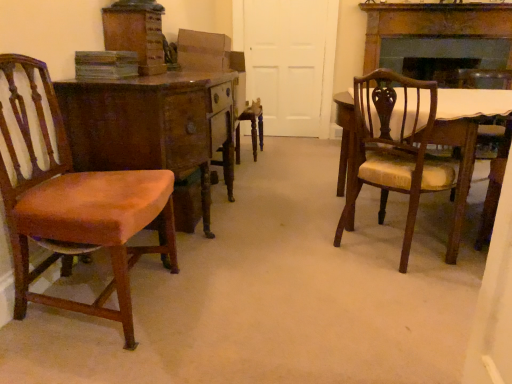
What do you see at coordinates (395, 146) in the screenshot?
I see `matte brown chair at right, positioned as the 2th chair in left-to-right order` at bounding box center [395, 146].

What is the approximate width of matte brown chair at right, positioned as the first chair in right-to-left order?

matte brown chair at right, positioned as the first chair in right-to-left order, is 14.33 inches wide.

Where is `wooden desk at left`? wooden desk at left is located at coordinates (143, 125).

At what (x,y) coordinates should I click in order to perform the action: click on matte brown chair at right, positioned as the first chair in right-to-left order. Please return your answer as a coordinate pair (x, y). Looking at the image, I should click on (395, 146).

From the image's perspective, which is below, wooden desk at left or matte brown chair at left, which appears as the 2th chair when viewed from the right?

matte brown chair at left, which appears as the 2th chair when viewed from the right.

Considering the relative sizes of wooden desk at left and matte brown chair at left, the first chair from the left, in the image provided, is wooden desk at left taller than matte brown chair at left, the first chair from the left,?

Incorrect, the height of wooden desk at left is not larger of that of matte brown chair at left, the first chair from the left.

Is matte brown chair at left, the first chair from the left, at the back of wooden desk at left?

That's not correct — wooden desk at left is not looking away from matte brown chair at left, the first chair from the left.

Can you see wooden desk at left touching matte brown chair at left, which appears as the 2th chair when viewed from the right?

wooden desk at left and matte brown chair at left, which appears as the 2th chair when viewed from the right, are not in contact.

Looking at this image, are white matte door at center and matte brown chair at left, which appears as the 2th chair when viewed from the right, located far from each other?

Yes, white matte door at center and matte brown chair at left, which appears as the 2th chair when viewed from the right, are quite far apart.

From a real-world perspective, starting from the white matte door at center, which chair is the 1st one below it? Please provide its 2D coordinates.

[(75, 205)]

Is white matte door at center bigger or smaller than matte brown chair at left, the first chair from the left?

Considering their sizes, white matte door at center takes up less space than matte brown chair at left, the first chair from the left.

How much distance is there between white matte door at center and matte brown chair at left, the first chair from the left?

white matte door at center is 3.13 meters away from matte brown chair at left, the first chair from the left.

Is matte brown chair at right, positioned as the first chair in right-to-left order, located within matte brown chair at left, the first chair from the left?

No, matte brown chair at left, the first chair from the left, does not contain matte brown chair at right, positioned as the first chair in right-to-left order.

You are a GUI agent. You are given a task and a screenshot of the screen. Output one action in this format:
    pyautogui.click(x=<x>, y=<y>)
    Task: Click on the chair located underneath the matte brown chair at left, the first chair from the left (from a real-world perspective)
    
    Given the screenshot: What is the action you would take?
    pyautogui.click(x=395, y=146)

Is matte brown chair at left, the first chair from the left, far away from matte brown chair at right, positioned as the 2th chair in left-to-right order?

Indeed, matte brown chair at left, the first chair from the left, is not near matte brown chair at right, positioned as the 2th chair in left-to-right order.

Is matte brown chair at left, which appears as the 2th chair when viewed from the right, closer to the viewer compared to matte brown chair at right, positioned as the first chair in right-to-left order?

Yes, matte brown chair at left, which appears as the 2th chair when viewed from the right, is closer to the viewer.

Considering the sizes of objects matte brown chair at left, which appears as the 2th chair when viewed from the right, and wooden desk at left in the image provided, who is thinner, matte brown chair at left, which appears as the 2th chair when viewed from the right, or wooden desk at left?

matte brown chair at left, which appears as the 2th chair when viewed from the right.

Are matte brown chair at left, the first chair from the left, and wooden desk at left far apart?

No, there isn't a large distance between matte brown chair at left, the first chair from the left, and wooden desk at left.

Is matte brown chair at left, the first chair from the left, oriented away from wooden desk at left?

That's not correct — matte brown chair at left, the first chair from the left, is not looking away from wooden desk at left.

How many degrees apart are the facing directions of matte brown chair at left, the first chair from the left, and wooden desk at left?

There is a 0.0944-degree angle between the facing directions of matte brown chair at left, the first chair from the left, and wooden desk at left.

From a real-world perspective, is matte brown chair at right, positioned as the first chair in right-to-left order, on top of wooden desk at left?

Yes, from a real-world perspective, matte brown chair at right, positioned as the first chair in right-to-left order, is on top of wooden desk at left.

Is matte brown chair at right, positioned as the 2th chair in left-to-right order, facing away from wooden desk at left?

That's not correct — matte brown chair at right, positioned as the 2th chair in left-to-right order, is not looking away from wooden desk at left.

From the picture: Is wooden desk at left a part of matte brown chair at right, positioned as the 2th chair in left-to-right order?

No, wooden desk at left is not surrounded by matte brown chair at right, positioned as the 2th chair in left-to-right order.

Is white matte door at center located within matte brown chair at left, the first chair from the left?

No, white matte door at center is not a part of matte brown chair at left, the first chair from the left.

Is matte brown chair at left, which appears as the 2th chair when viewed from the right, at the left side of white matte door at center?

Indeed, matte brown chair at left, which appears as the 2th chair when viewed from the right, is positioned on the left side of white matte door at center.

Who is more distant, matte brown chair at left, the first chair from the left, or white matte door at center?

white matte door at center is further away from the camera.

At what (x,y) coordinates should I click in order to perform the action: click on the 2nd chair below the white matte door at center (from the image's perspective). Please return your answer as a coordinate pair (x, y). The image size is (512, 384). Looking at the image, I should click on (75, 205).

Is wooden desk at left not close to matte brown chair at right, positioned as the first chair in right-to-left order?

They are positioned close to each other.

Can you confirm if wooden desk at left is thinner than matte brown chair at right, positioned as the 2th chair in left-to-right order?

No, wooden desk at left is not thinner than matte brown chair at right, positioned as the 2th chair in left-to-right order.

In order to click on chair that is the 1st object located below the wooden desk at left (from the image's perspective) in this screenshot , I will do `click(395, 146)`.

What's the angular difference between wooden desk at left and matte brown chair at right, positioned as the 2th chair in left-to-right order,'s facing directions?

There is a 53.6-degree angle between the facing directions of wooden desk at left and matte brown chair at right, positioned as the 2th chair in left-to-right order.

Where is `the 2nd chair directly above the wooden desk at left (from a real-world perspective)`? the 2nd chair directly above the wooden desk at left (from a real-world perspective) is located at coordinates (75, 205).

From the image's perspective, starting from the white matte door at center, which chair is the 2nd one below? Please provide its 2D coordinates.

[(75, 205)]

From the image, which object appears to be nearer to matte brown chair at left, which appears as the 2th chair when viewed from the right, wooden desk at left or matte brown chair at right, positioned as the 2th chair in left-to-right order?

wooden desk at left lies closer to matte brown chair at left, which appears as the 2th chair when viewed from the right, than the other object.

Considering their positions, is wooden desk at left positioned further to matte brown chair at right, positioned as the 2th chair in left-to-right order, than white matte door at center?

Among the two, white matte door at center is located further to matte brown chair at right, positioned as the 2th chair in left-to-right order.

Considering their positions, is matte brown chair at right, positioned as the 2th chair in left-to-right order, positioned closer to matte brown chair at left, the first chair from the left, than white matte door at center?

The object closer to matte brown chair at left, the first chair from the left, is matte brown chair at right, positioned as the 2th chair in left-to-right order.

From the image, which object appears to be nearer to matte brown chair at right, positioned as the first chair in right-to-left order, wooden desk at left or matte brown chair at left, the first chair from the left?

wooden desk at left is positioned closer to the anchor matte brown chair at right, positioned as the first chair in right-to-left order.

From the image, which object appears to be farther from wooden desk at left, white matte door at center or matte brown chair at right, positioned as the first chair in right-to-left order?

white matte door at center is further to wooden desk at left.

Looking at the image, which one is located further to matte brown chair at left, the first chair from the left, wooden desk at left or white matte door at center?

white matte door at center lies further to matte brown chair at left, the first chair from the left, than the other object.

Consider the image. From the image, which object appears to be nearer to white matte door at center, wooden desk at left or matte brown chair at left, which appears as the 2th chair when viewed from the right?

Based on the image, wooden desk at left appears to be nearer to white matte door at center.

Estimate the real-world distances between objects in this image. Which object is further from matte brown chair at right, positioned as the 2th chair in left-to-right order, matte brown chair at left, the first chair from the left, or wooden desk at left?

matte brown chair at left, the first chair from the left.

What are the coordinates of `desk situated between matte brown chair at left, which appears as the 2th chair when viewed from the right, and matte brown chair at right, positioned as the first chair in right-to-left order, from left to right` in the screenshot? It's located at (143, 125).

In order to click on desk between matte brown chair at right, positioned as the 2th chair in left-to-right order, and white matte door at center in the front-back direction in this screenshot , I will do tap(143, 125).

At what (x,y) coordinates should I click in order to perform the action: click on desk positioned between matte brown chair at left, which appears as the 2th chair when viewed from the right, and white matte door at center from near to far. Please return your answer as a coordinate pair (x, y). The height and width of the screenshot is (384, 512). Looking at the image, I should click on tap(143, 125).

Locate an element on the screen. The height and width of the screenshot is (384, 512). chair between matte brown chair at left, the first chair from the left, and white matte door at center, along the z-axis is located at coordinates (395, 146).